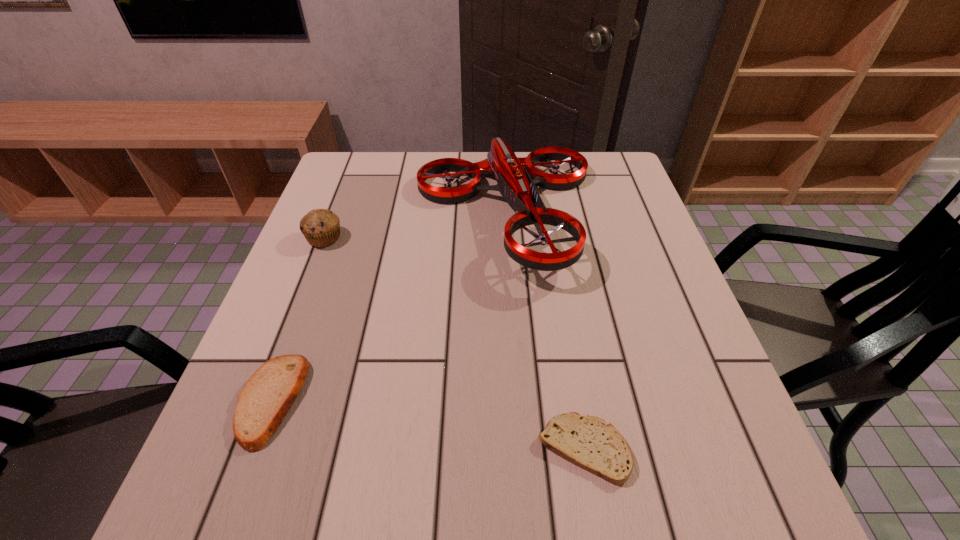
You are a GUI agent. You are given a task and a screenshot of the screen. Output one action in this format:
    pyautogui.click(x=<x>, y=<y>)
    Task: Click on the object located at the far edge
    This screenshot has width=960, height=540.
    Given the screenshot: What is the action you would take?
    pyautogui.click(x=515, y=185)

Find the location of a particular element. object at the near edge is located at coordinates (590, 443).

This screenshot has width=960, height=540. Find the location of `muffin located in the left edge section of the desktop`. muffin located in the left edge section of the desktop is located at coordinates (321, 227).

At what (x,y) coordinates should I click in order to perform the action: click on pita bread positioned at the left edge. Please return your answer as a coordinate pair (x, y). Looking at the image, I should click on tap(267, 396).

Find the location of a particular element. The height and width of the screenshot is (540, 960). object present at the right edge is located at coordinates (515, 185).

Where is `object at the far right corner`? object at the far right corner is located at coordinates (515, 185).

The width and height of the screenshot is (960, 540). In the image, there is a desktop. What are the coordinates of `vacant region at the near edge` in the screenshot? It's located at (572, 485).

I want to click on vacant area at the left edge of the desktop, so click(370, 214).

I want to click on free space at the right edge of the desktop, so click(x=657, y=254).

Identify the location of free space at the near left corner. This screenshot has width=960, height=540. (222, 509).